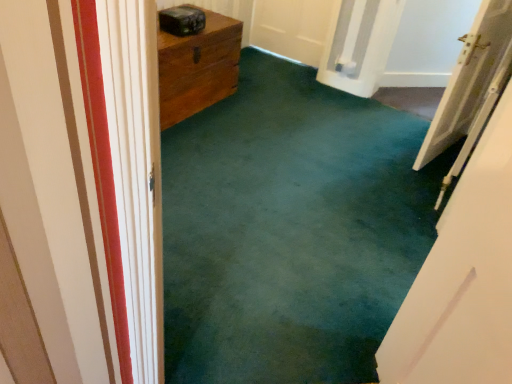
The image size is (512, 384). What do you see at coordinates (469, 79) in the screenshot?
I see `white wooden door at right` at bounding box center [469, 79].

The width and height of the screenshot is (512, 384). Identify the location of white wooden door at right. (469, 79).

In order to click on green carpet at center in this screenshot , I will do (x=290, y=230).

In order to face green carpet at center, should I rotate leftwards or rightwards?

To face it directly, rotate right by 9.108 degrees.

The width and height of the screenshot is (512, 384). Describe the element at coordinates (290, 230) in the screenshot. I see `green carpet at center` at that location.

Find the location of a particular element. This screenshot has width=512, height=384. white wooden door at right is located at coordinates (469, 79).

Considering the relative positions of white wooden door at right and green carpet at center in the image provided, is white wooden door at right to the right of green carpet at center from the viewer's perspective?

Indeed, white wooden door at right is positioned on the right side of green carpet at center.

Which object is further away from the camera taking this photo, white wooden door at right or green carpet at center?

white wooden door at right is further away from the camera.

Which point is more distant from viewer, (487, 53) or (413, 220)?

The point (487, 53) is behind.

From the image's perspective, does white wooden door at right appear lower than green carpet at center?

No, from the image's perspective, white wooden door at right is not below green carpet at center.

From a real-world perspective, is white wooden door at right positioned over green carpet at center based on gravity?

No.

Considering the sizes of objects white wooden door at right and green carpet at center in the image provided, who is thinner, white wooden door at right or green carpet at center?

With smaller width is white wooden door at right.

Is white wooden door at right taller than green carpet at center?

In fact, white wooden door at right may be shorter than green carpet at center.

Which of these two, white wooden door at right or green carpet at center, is smaller?

white wooden door at right is smaller.

Is white wooden door at right inside the boundaries of green carpet at center, or outside?

white wooden door at right is outside green carpet at center.

Does white wooden door at right touch green carpet at center?

No, white wooden door at right is not next to green carpet at center.

Does white wooden door at right turn towards green carpet at center?

No, white wooden door at right is not turned towards green carpet at center.

How distant is white wooden door at right from green carpet at center?

The distance of white wooden door at right from green carpet at center is 29.74 inches.

Identify the location of corridor on the left of white wooden door at right. The image size is (512, 384). (290, 230).

Which object is positioned more to the right, green carpet at center or white wooden door at right?

Positioned to the right is white wooden door at right.

Is the depth of green carpet at center less than that of white wooden door at right?

Yes, it is in front of white wooden door at right.

Is point (432, 231) closer or farther from the camera than point (479, 35)?

Point (432, 231) appears to be closer to the viewer than point (479, 35).

From the image's perspective, is green carpet at center located above or below white wooden door at right?

green carpet at center is situated lower than white wooden door at right in the image.

From a real-world perspective, which is physically below, green carpet at center or white wooden door at right?

white wooden door at right.

Is green carpet at center thinner than white wooden door at right?

No, green carpet at center is not thinner than white wooden door at right.

Which of these two, green carpet at center or white wooden door at right, stands taller?

Standing taller between the two is green carpet at center.

Based on their sizes in the image, would you say green carpet at center is bigger or smaller than white wooden door at right?

Considering their sizes, green carpet at center takes up more space than white wooden door at right.

Is green carpet at center located outside white wooden door at right?

That's correct, green carpet at center is outside of white wooden door at right.

Is green carpet at center in contact with white wooden door at right?

No, green carpet at center is not next to white wooden door at right.

Is green carpet at center oriented towards white wooden door at right?

No, green carpet at center does not turn towards white wooden door at right.

What's the angular difference between green carpet at center and white wooden door at right's facing directions?

There is a 128-degree angle between the facing directions of green carpet at center and white wooden door at right.

Find the location of a particular element. Image resolution: width=512 pixels, height=384 pixels. door behind the green carpet at center is located at coordinates (469, 79).

Identify the location of door on the right of the green carpet at center. (469, 79).

You are a GUI agent. You are given a task and a screenshot of the screen. Output one action in this format:
    pyautogui.click(x=<x>, y=<y>)
    Task: Click on the corridor in front of the white wooden door at right
    The width and height of the screenshot is (512, 384).
    Given the screenshot: What is the action you would take?
    pyautogui.click(x=290, y=230)